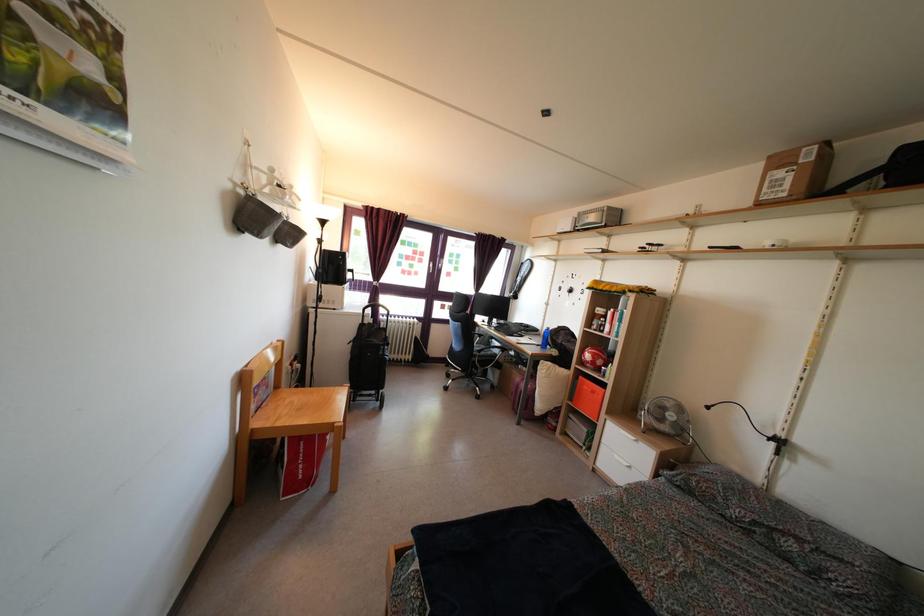
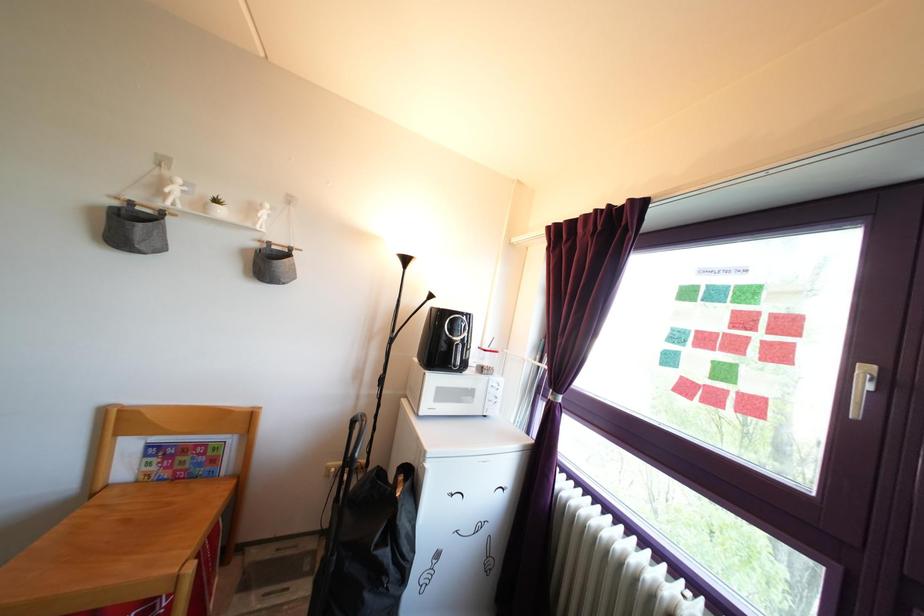
Find the pixel in the second image that matches point 411,282 in the first image.

(715, 407)